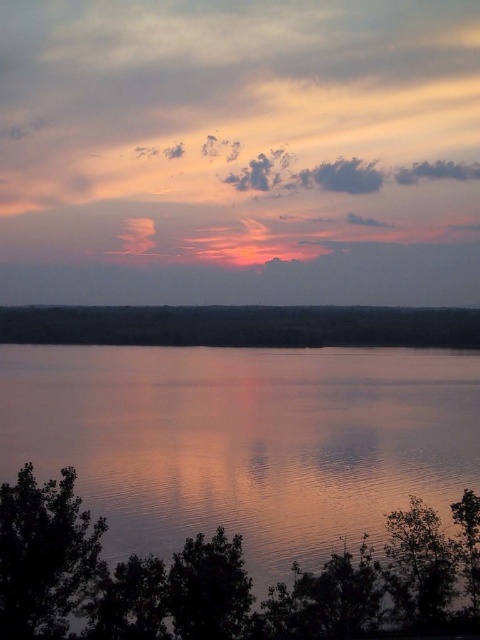
Question: Does smooth reflective water at center appear on the right side of smooth dark water at center?

Choices:
 (A) yes
 (B) no

Answer: (A)

Question: Is the position of smooth reflective water at center more distant than that of smooth dark water at center?

Choices:
 (A) yes
 (B) no

Answer: (B)

Question: Does smooth reflective water at center appear under smooth dark water at center?

Choices:
 (A) no
 (B) yes

Answer: (B)

Question: Which of the following is the closest to the observer?

Choices:
 (A) click(327, 429)
 (B) click(113, 326)

Answer: (A)